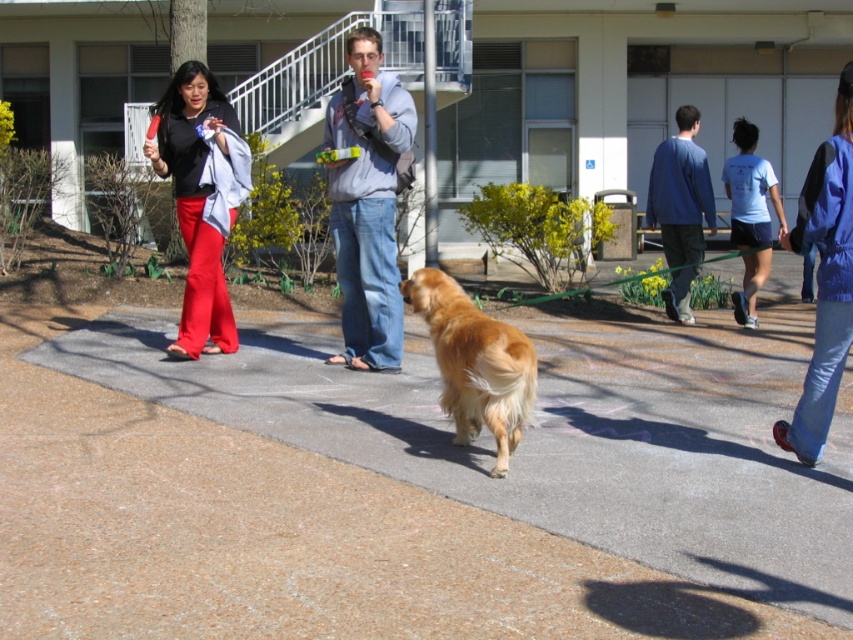
Who is more forward, (843, 349) or (746, 256)?

Point (843, 349) is more forward.

Image resolution: width=853 pixels, height=640 pixels. What do you see at coordinates (824, 278) in the screenshot? I see `blue fabric jacket at lower right` at bounding box center [824, 278].

Is point (827, 236) positioned in front of point (746, 253)?

Yes, point (827, 236) is closer to viewer.

Locate an element on the screen. This screenshot has width=853, height=640. blue fabric jacket at lower right is located at coordinates (824, 278).

Looking at this image, between blue fabric jacket at lower right and blue cotton shirt at right, which one is positioned higher?

Positioned higher is blue cotton shirt at right.

This screenshot has height=640, width=853. Find the location of `blue fabric jacket at lower right`. blue fabric jacket at lower right is located at coordinates (824, 278).

Who is shorter, brown concrete pavement at center or light gray sweatshirt at center?

brown concrete pavement at center is shorter.

How distant is brown concrete pavement at center from light gray sweatshirt at center?

brown concrete pavement at center and light gray sweatshirt at center are 2.44 meters apart from each other.

Measure the distance between point (51, 336) and camera.

Point (51, 336) and camera are 9.15 meters apart from each other.

What are the coordinates of `brown concrete pavement at center` in the screenshot? It's located at (399, 488).